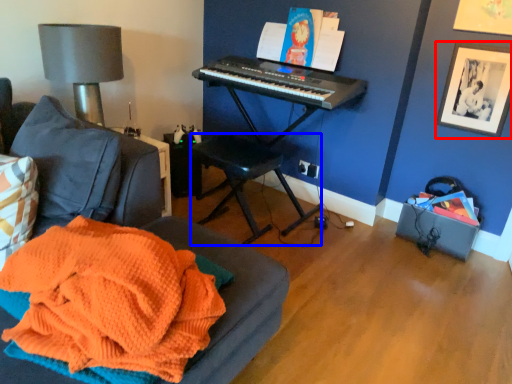
Question: Which object is closer to the camera taking this photo, picture frame (highlighted by a red box) or music stool (highlighted by a blue box)?

Choices:
 (A) picture frame
 (B) music stool

Answer: (B)